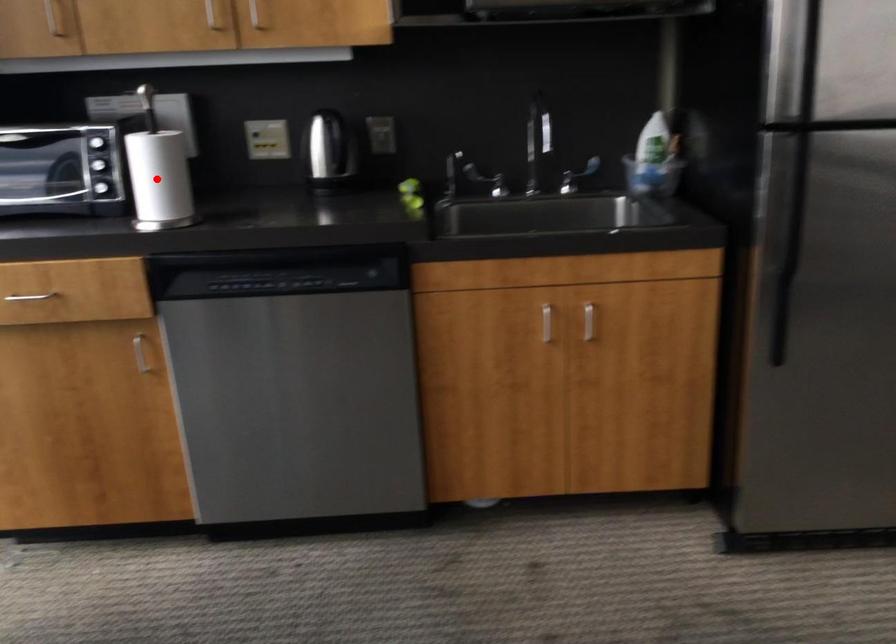
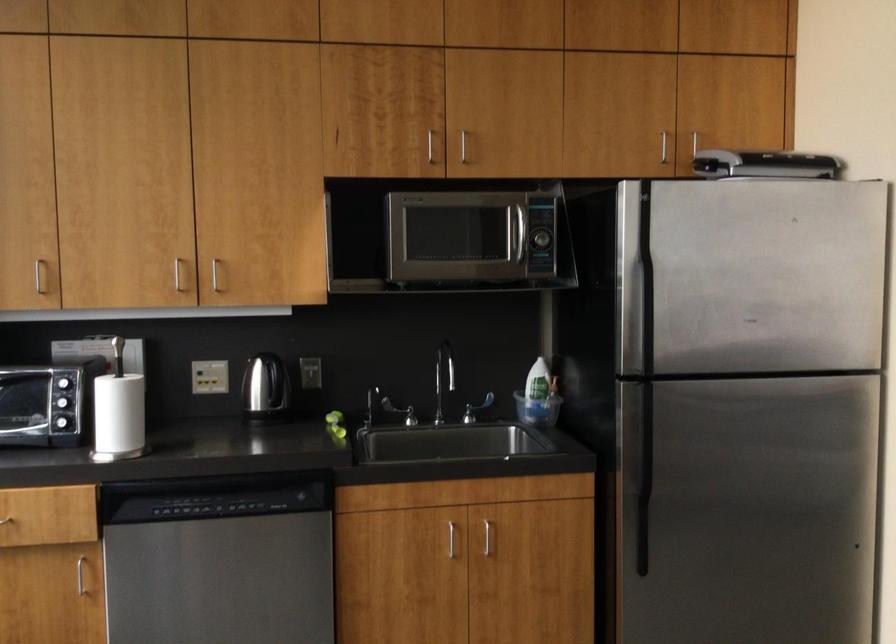
In the second image, find the point that corresponds to the highlighted location in the first image.

(117, 415)